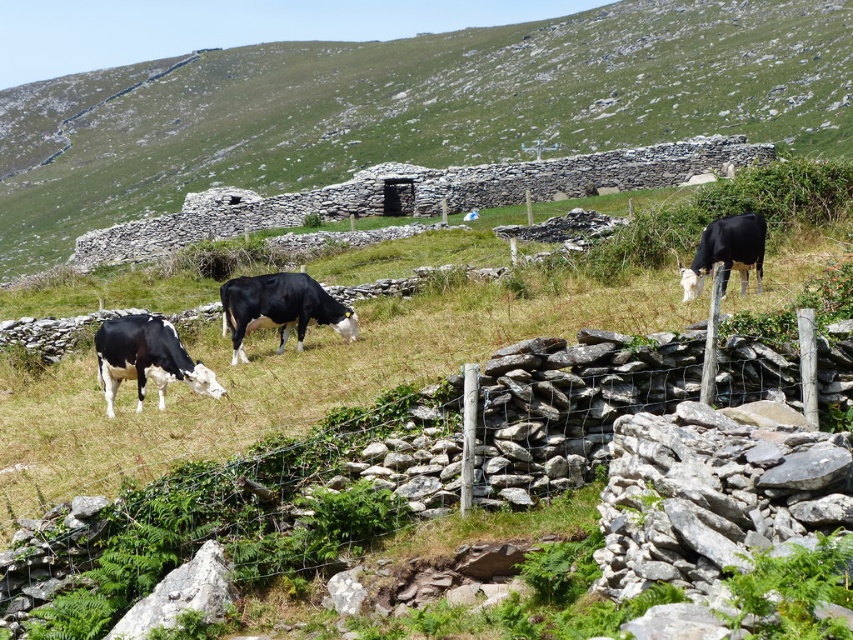
You are a farmer checking the boundaries of your field. You notice a wire mesh fence at lower left and a black glossy cow at lower left. Which object is bigger in size?

The wire mesh fence at lower left is larger in size compared to the black glossy cow at lower left according to the description.

You are standing in the grassy field and want to walk towards the cow that is closer to you. The cows are located at point [137,336] and point [267,291]. Which cow should you head towards?

You should head towards the cow at point [137,336] because it is closer to you than the cow at point [267,291].